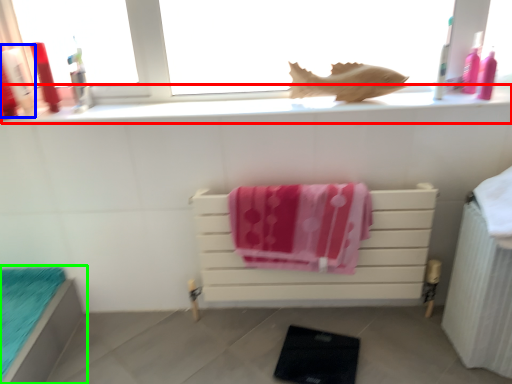
Question: Based on their relative distances, which object is farther from window sill (highlighted by a red box)? Choose from toiletry (highlighted by a blue box) and furniture (highlighted by a green box).

Choices:
 (A) toiletry
 (B) furniture

Answer: (B)